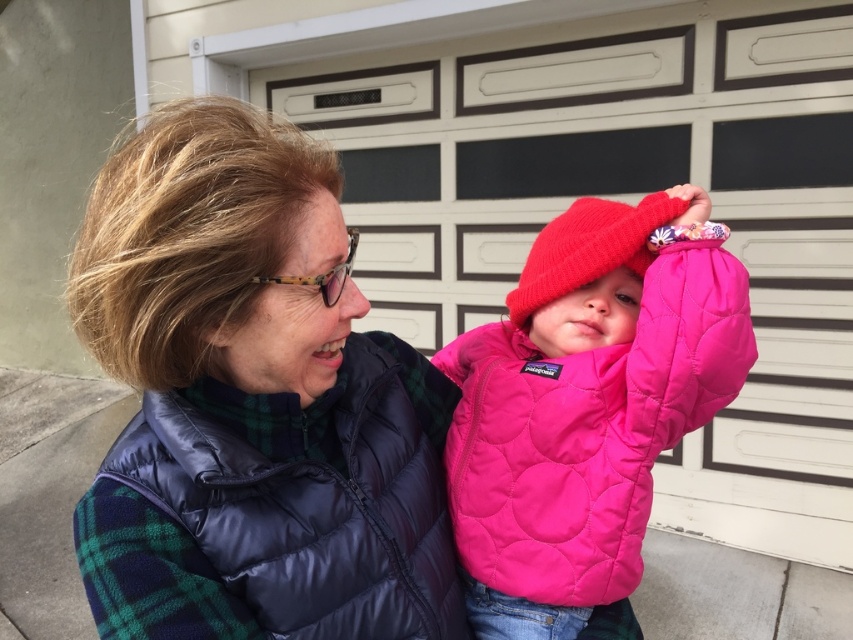
You are a fashion designer who needs to create a matching accessory for both the navy blue puffer jacket at center and the knitted woolen hat at center. Given the distance between them, can you suggest a necklace length that would complement both items without being too long or too short?

The distance between the navy blue puffer jacket at center and the knitted woolen hat at center is 39.46 centimeters. A necklace length of approximately 40 centimeters would complement both items, ensuring it is neither too long nor too short.

From the picture: You are a fashion designer looking to create a new line of winter clothing. You observe the pink quilted jacket at center and the knitted woolen hat at center on a child. Which item would require more fabric to produce a similar size for an adult?

The pink quilted jacket at center would require more fabric to produce a similar size for an adult since it is bigger than the knitted woolen hat at center.